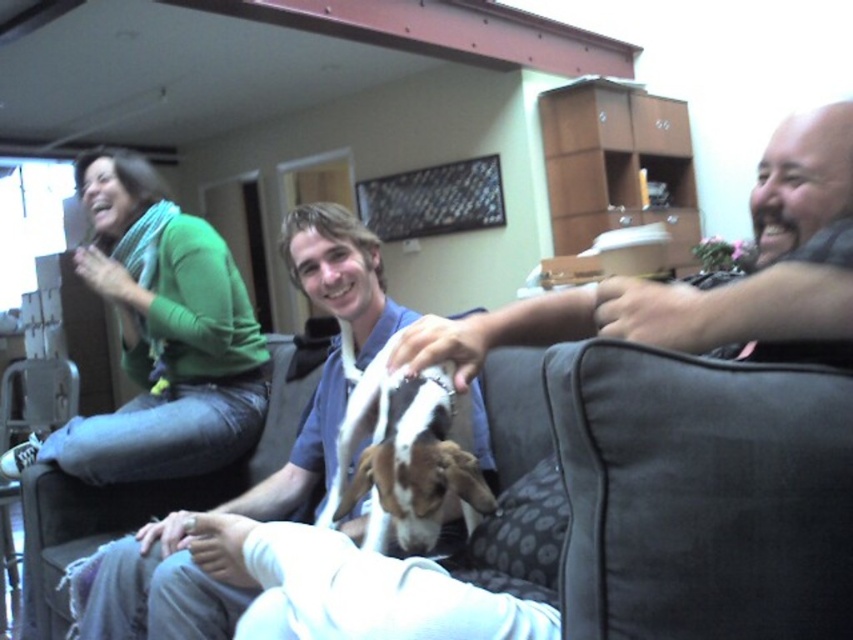
Is white soft shirt at center positioned behind white fur dog at center?

Yes, white soft shirt at center is further from the viewer.

Can you confirm if white soft shirt at center is bigger than white fur dog at center?

Indeed, white soft shirt at center has a larger size compared to white fur dog at center.

Looking at this image, measure the distance between white soft shirt at center and camera.

3.88 feet

The height and width of the screenshot is (640, 853). I want to click on white soft shirt at center, so click(160, 592).

Between green sweater at upper left and white soft shirt at center, which one appears on the left side from the viewer's perspective?

green sweater at upper left

Who is lower down, green sweater at upper left or white soft shirt at center?

white soft shirt at center is lower down.

Between point (187, 332) and point (167, 634), which one is positioned behind?

Positioned behind is point (187, 332).

This screenshot has height=640, width=853. Find the location of `green sweater at upper left`. green sweater at upper left is located at coordinates tap(163, 333).

Locate an element on the screen. smooth gray shirt at right is located at coordinates (701, 289).

Can you confirm if smooth gray shirt at right is thinner than white fur dog at center?

No.

What do you see at coordinates (701, 289) in the screenshot? I see `smooth gray shirt at right` at bounding box center [701, 289].

Find the location of a particular element. The height and width of the screenshot is (640, 853). smooth gray shirt at right is located at coordinates (701, 289).